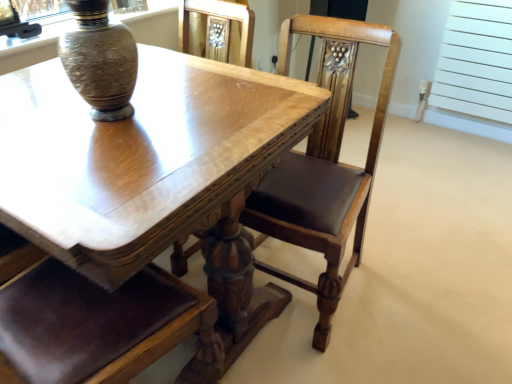
Locate an element on the screen. Image resolution: width=512 pixels, height=384 pixels. free space to the back side of speckled ceramic vase at upper left is located at coordinates (159, 82).